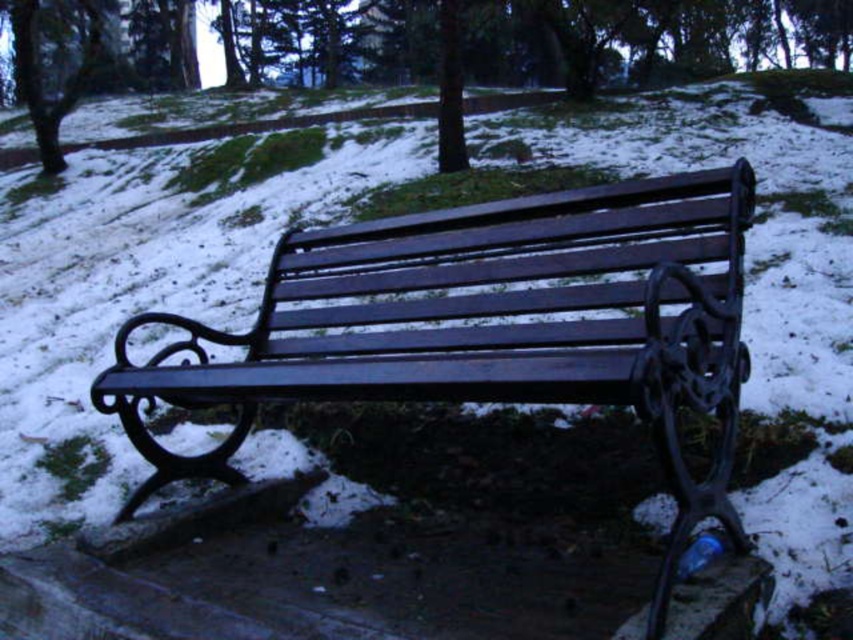
Who is positioned more to the left, green matte tree at center or smooth bark tree at upper left?

smooth bark tree at upper left is more to the left.

Which is above, green matte tree at center or smooth bark tree at upper left?

smooth bark tree at upper left is higher up.

Between point (379, 45) and point (19, 54), which one is positioned in front?

Point (19, 54)

This screenshot has width=853, height=640. Identify the location of green matte tree at center. [523, 42].